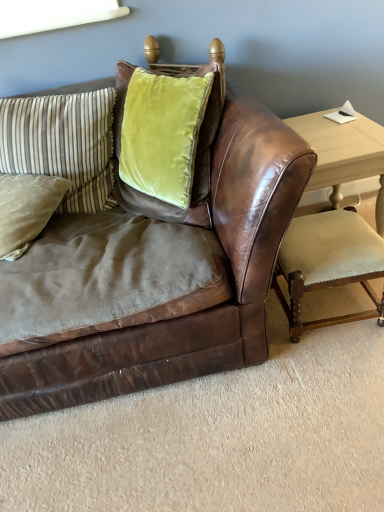
Where is `free location above velvet beige armchair at lower right (from a real-world perspective)`? Image resolution: width=384 pixels, height=512 pixels. free location above velvet beige armchair at lower right (from a real-world perspective) is located at coordinates (321, 237).